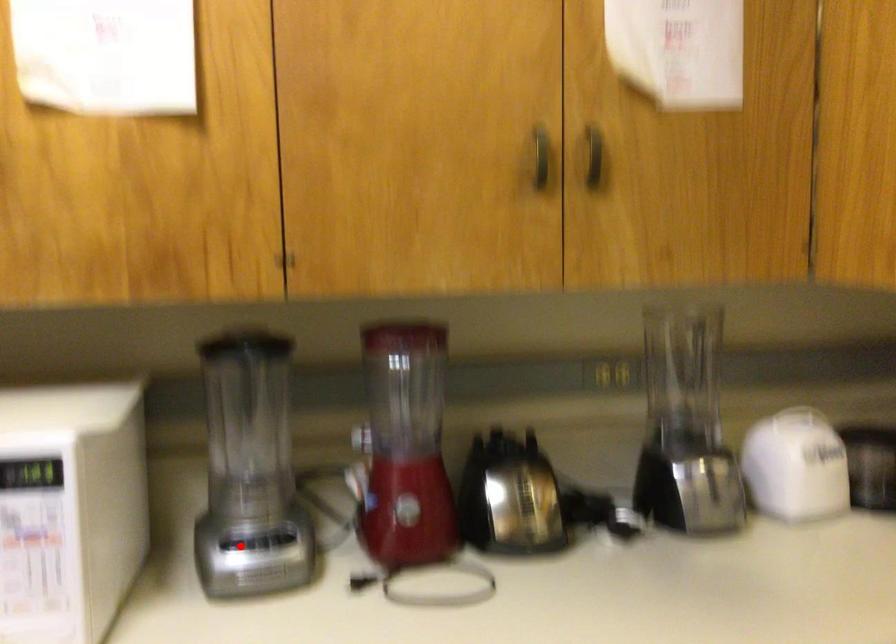
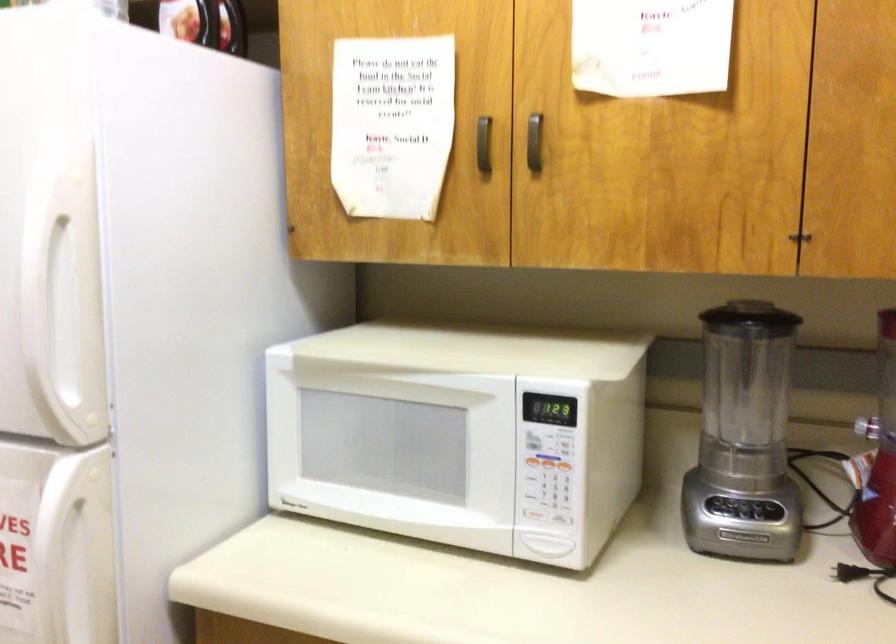
Find the pixel in the second image that matches the highlighted location in the first image.

(725, 506)